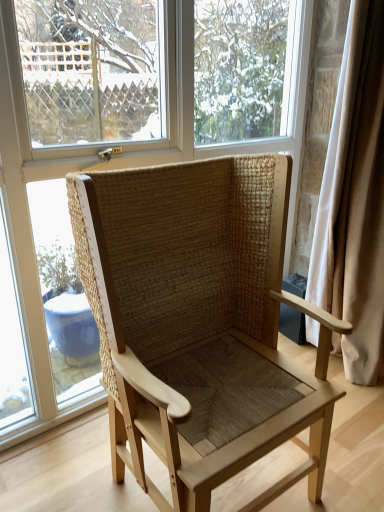
Question: Can you confirm if transparent glass window at center is shorter than natural woven wood chair at center?

Choices:
 (A) yes
 (B) no

Answer: (B)

Question: Is transparent glass window at center surrounding natural woven wood chair at center?

Choices:
 (A) no
 (B) yes

Answer: (A)

Question: Can you confirm if transparent glass window at center is bigger than natural woven wood chair at center?

Choices:
 (A) yes
 (B) no

Answer: (B)

Question: Does transparent glass window at center have a greater height compared to natural woven wood chair at center?

Choices:
 (A) no
 (B) yes

Answer: (B)

Question: Can you confirm if transparent glass window at center is positioned to the left of natural woven wood chair at center?

Choices:
 (A) yes
 (B) no

Answer: (A)

Question: From a real-world perspective, is transparent glass window at center below natural woven wood chair at center?

Choices:
 (A) no
 (B) yes

Answer: (A)

Question: Is the depth of transparent glass window at center greater than that of white fabric curtain at right?

Choices:
 (A) yes
 (B) no

Answer: (B)

Question: Is transparent glass window at center located outside white fabric curtain at right?

Choices:
 (A) yes
 (B) no

Answer: (A)

Question: Does transparent glass window at center have a lesser height compared to white fabric curtain at right?

Choices:
 (A) yes
 (B) no

Answer: (B)

Question: Considering the relative sizes of transparent glass window at center and white fabric curtain at right in the image provided, is transparent glass window at center taller than white fabric curtain at right?

Choices:
 (A) no
 (B) yes

Answer: (B)

Question: From the image's perspective, is transparent glass window at center located beneath white fabric curtain at right?

Choices:
 (A) no
 (B) yes

Answer: (A)

Question: Does transparent glass window at center appear on the left side of white fabric curtain at right?

Choices:
 (A) no
 (B) yes

Answer: (B)

Question: Is natural woven wood chair at center looking in the opposite direction of transparent glass window at center?

Choices:
 (A) no
 (B) yes

Answer: (B)